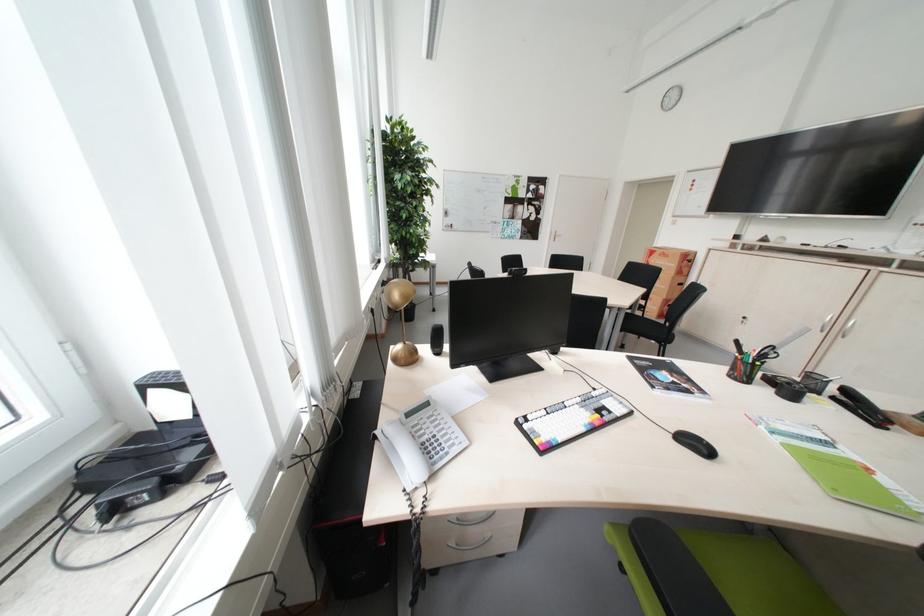
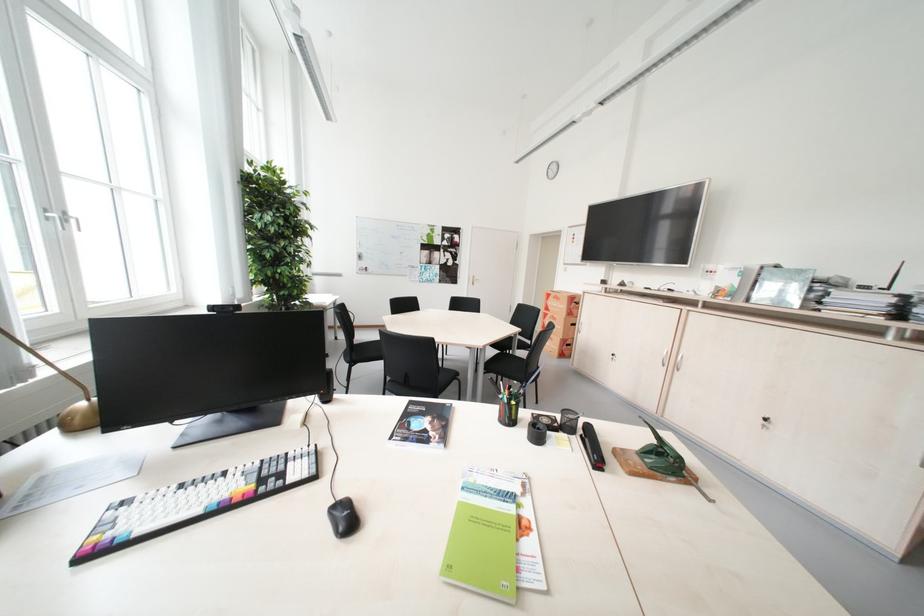
The point at (554, 230) is marked in the first image. Where is the corresponding point in the second image?

(473, 275)